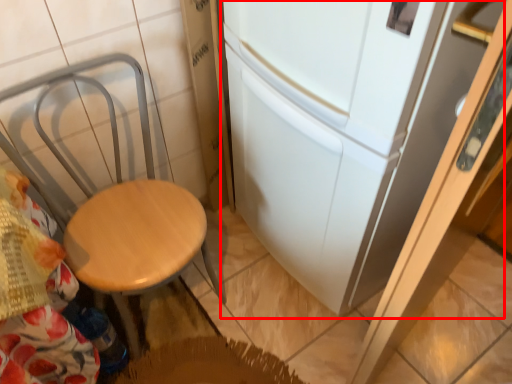
Question: From the image's perspective, what is the correct spatial relationship of fridge (annotated by the red box) in relation to chair?

Choices:
 (A) above
 (B) below

Answer: (A)